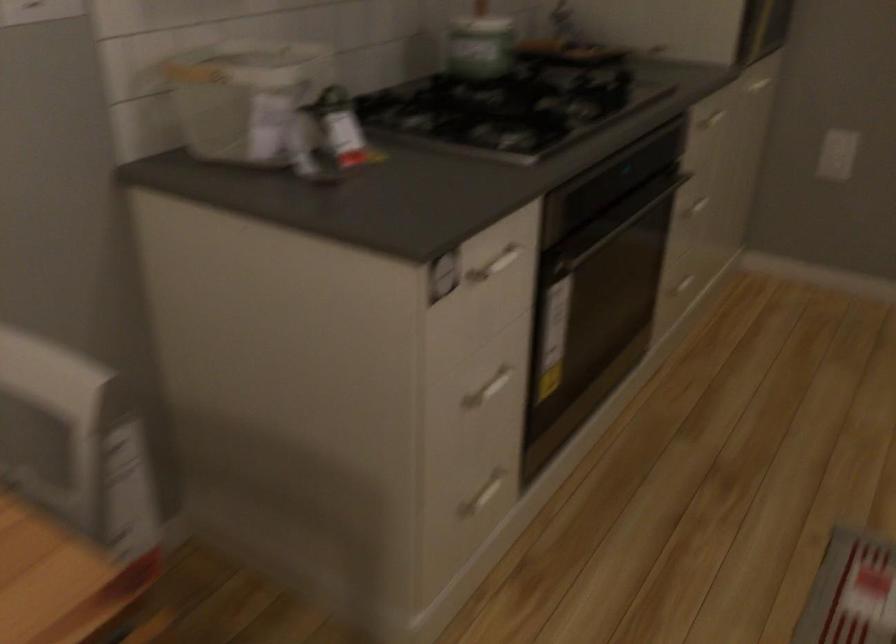
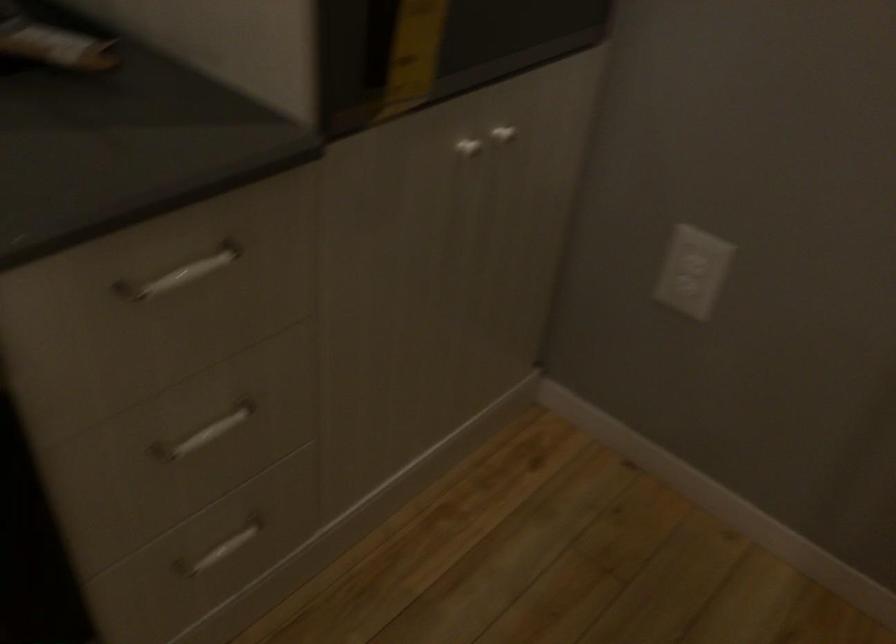
In a continuous first-person perspective shot, in which direction is the camera moving?

The cameraman walked toward right, forward.